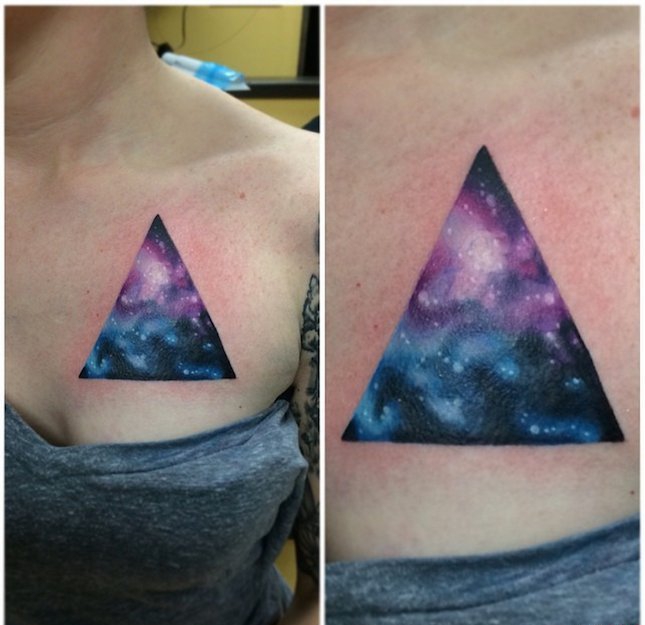
You are a GUI agent. You are given a task and a screenshot of the screen. Output one action in this format:
    pyautogui.click(x=<x>, y=<y>)
    Task: Click on the wall
    Image resolution: width=645 pixels, height=625 pixels.
    Given the screenshot: What is the action you would take?
    pyautogui.click(x=210, y=41), pyautogui.click(x=271, y=108)